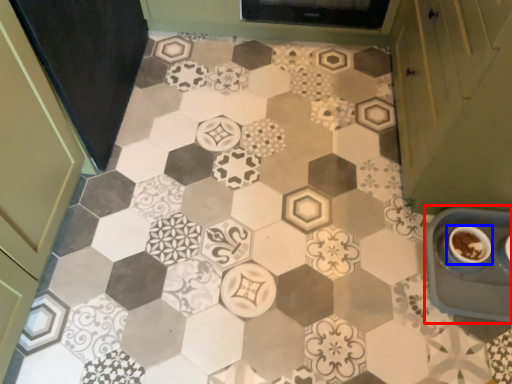
Question: Which object is further to the camera taking this photo, sink (highlighted by a red box) or coffee cup (highlighted by a blue box)?

Choices:
 (A) sink
 (B) coffee cup

Answer: (B)